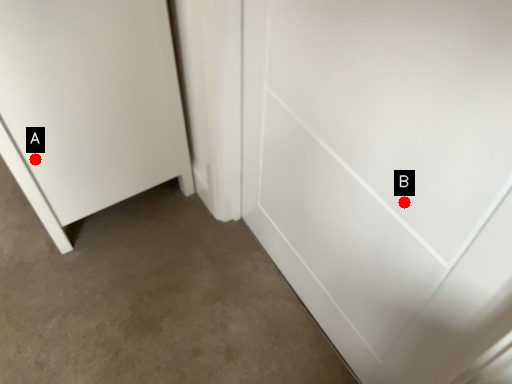
Question: Two points are circled on the image, labeled by A and B beside each circle. Which of the following is the farthest from the observer?

Choices:
 (A) A is further
 (B) B is further

Answer: (A)